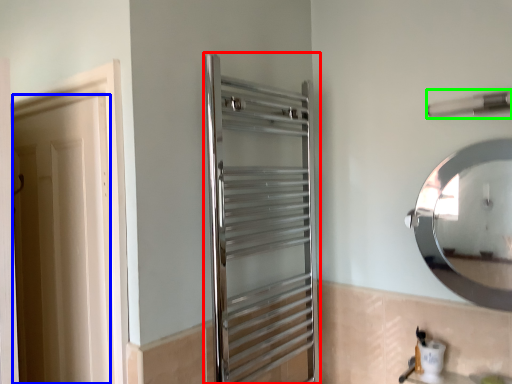
Question: Which object is the closest to the screen door (highlighted by a red box)? Choose among these: door (highlighted by a blue box) or towel bar (highlighted by a green box).

Choices:
 (A) door
 (B) towel bar

Answer: (A)